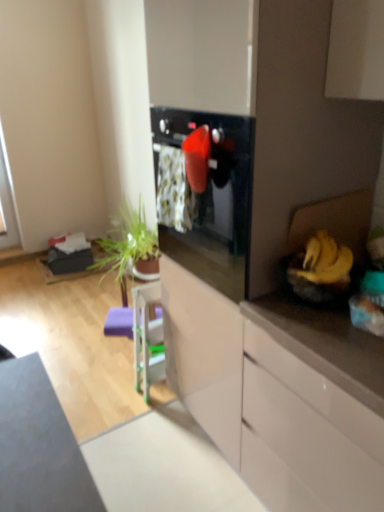
Question: Does white glossy cabinet at right, the 2th cabinetry viewed from the back, touch yellow matte banana at right?

Choices:
 (A) no
 (B) yes

Answer: (A)

Question: Does white glossy cabinet at right, which ranks as the first cabinetry in front-to-back order, have a lesser height compared to yellow matte banana at right?

Choices:
 (A) yes
 (B) no

Answer: (B)

Question: From a real-world perspective, is white glossy cabinet at right, the 2th cabinetry viewed from the back, under yellow matte banana at right?

Choices:
 (A) no
 (B) yes

Answer: (B)

Question: Considering the relative sizes of white glossy cabinet at right, the 2th cabinetry viewed from the back, and yellow matte banana at right in the image provided, is white glossy cabinet at right, the 2th cabinetry viewed from the back, wider than yellow matte banana at right?

Choices:
 (A) no
 (B) yes

Answer: (B)

Question: Is white glossy cabinet at right, the 2th cabinetry viewed from the back, smaller than yellow matte banana at right?

Choices:
 (A) no
 (B) yes

Answer: (A)

Question: Is white glossy cabinet at right, which ranks as the first cabinetry in front-to-back order, to the right of yellow matte banana at right from the viewer's perspective?

Choices:
 (A) yes
 (B) no

Answer: (A)

Question: From the image's perspective, is white glossy dresser at center over white glossy cabinet at center, arranged as the first cabinetry when viewed from the back?

Choices:
 (A) no
 (B) yes

Answer: (B)

Question: Can you confirm if white glossy dresser at center is positioned to the left of white glossy cabinet at center, arranged as the first cabinetry when viewed from the back?

Choices:
 (A) no
 (B) yes

Answer: (A)

Question: Does white glossy dresser at center appear on the right side of white glossy cabinet at center, the 2th cabinetry when ordered from front to back?

Choices:
 (A) no
 (B) yes

Answer: (B)

Question: From the image's perspective, is white glossy dresser at center beneath white glossy cabinet at center, the 2th cabinetry when ordered from front to back?

Choices:
 (A) yes
 (B) no

Answer: (B)

Question: Is white glossy dresser at center smaller than white glossy cabinet at center, arranged as the first cabinetry when viewed from the back?

Choices:
 (A) no
 (B) yes

Answer: (A)

Question: Does white glossy dresser at center have a greater width compared to white glossy cabinet at center, arranged as the first cabinetry when viewed from the back?

Choices:
 (A) no
 (B) yes

Answer: (A)

Question: Considering the relative sizes of white glossy cabinet at center, arranged as the first cabinetry when viewed from the back, and white glossy dresser at center in the image provided, is white glossy cabinet at center, arranged as the first cabinetry when viewed from the back, bigger than white glossy dresser at center?

Choices:
 (A) yes
 (B) no

Answer: (B)